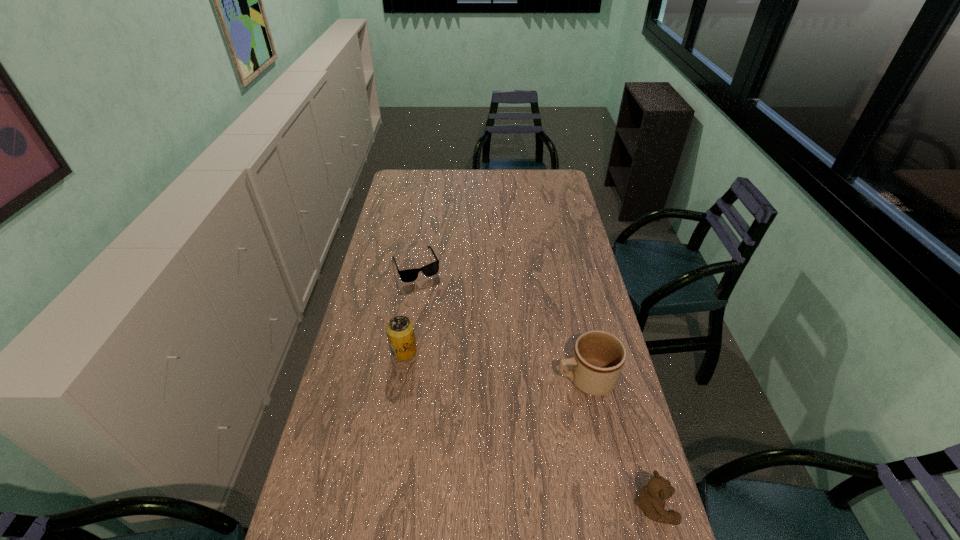
You are a GUI agent. You are given a task and a screenshot of the screen. Output one action in this format:
    pyautogui.click(x=<x>, y=<y>)
    Task: Click on the beer can
    
    Given the screenshot: What is the action you would take?
    pyautogui.click(x=400, y=331)

Identify the location of the nearest object. This screenshot has height=540, width=960. (651, 499).

Locate an element on the screen. Image resolution: width=960 pixels, height=540 pixels. mug is located at coordinates (598, 358).

Find the location of a particular element. The width and height of the screenshot is (960, 540). the shortest object is located at coordinates (409, 275).

Image resolution: width=960 pixels, height=540 pixels. I want to click on the farthest object, so pyautogui.click(x=409, y=275).

You are a GUI agent. You are given a task and a screenshot of the screen. Output one action in this format:
    pyautogui.click(x=<x>, y=<y>)
    Task: Click on the vacant position located on the front of the beer can
    The height and width of the screenshot is (540, 960).
    Given the screenshot: What is the action you would take?
    pyautogui.click(x=399, y=380)

At what (x,y) coordinates should I click in order to perform the action: click on vacant space located 0.110m on the side of the mug with the handle. Please return your answer as a coordinate pair (x, y). Looking at the image, I should click on (522, 390).

Locate an element on the screen. vacant space located on the side of the mug with the handle is located at coordinates (493, 396).

What are the coordinates of `free region located 0.160m on the side of the mug with the handle` in the screenshot? It's located at (506, 393).

Where is `free space located on the front-facing side of the shortest object`? The height and width of the screenshot is (540, 960). free space located on the front-facing side of the shortest object is located at coordinates (445, 327).